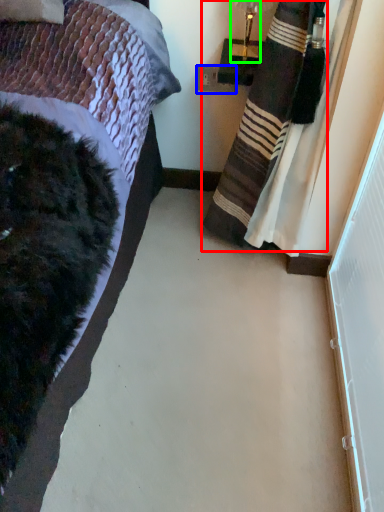
Question: Estimate the real-world distances between objects in this image. Which object is farther from curtain (highlighted by a red box), power outlet (highlighted by a blue box) or lamp (highlighted by a green box)?

Choices:
 (A) power outlet
 (B) lamp

Answer: (A)